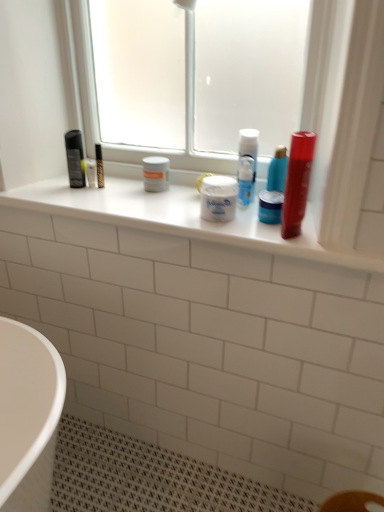
Question: Considering the positions of white matte jar at center and blue glossy jar at center, the first mouthwash viewed from the back, in the image, is white matte jar at center bigger or smaller than blue glossy jar at center, the first mouthwash viewed from the back,?

Choices:
 (A) small
 (B) big

Answer: (B)

Question: From their relative heights in the image, would you say white matte jar at center is taller or shorter than blue glossy jar at center, the first mouthwash viewed from the back?

Choices:
 (A) short
 (B) tall

Answer: (B)

Question: Considering the real-world distances, which object is farthest from the transparent frosted glass at upper center?

Choices:
 (A) blue glossy jar at center, which ranks as the second mouthwash in front-to-back order
 (B) shiny red tube at upper right, which is the first mouthwash in front-to-back order
 (C) white matte jar at center
 (D) white plastic container at center

Answer: (A)

Question: Which is nearer to the transparent frosted glass at upper center?

Choices:
 (A) blue glossy jar at center, which ranks as the second mouthwash in front-to-back order
 (B) white matte jar at center
 (C) shiny red tube at upper right, which is the first mouthwash in front-to-back order
 (D) white plastic container at center

Answer: (D)